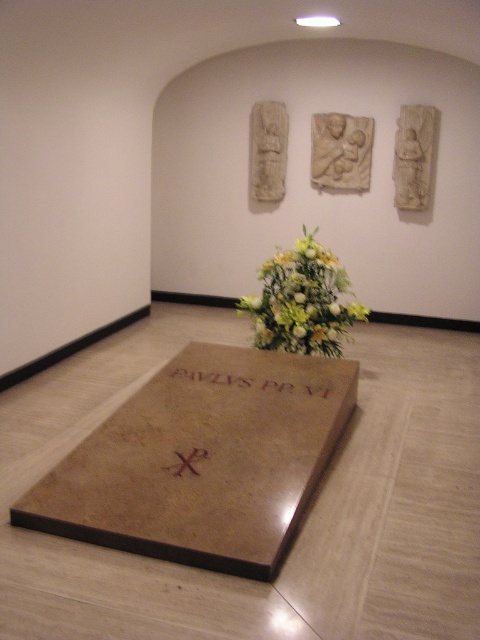
Question: Does yellow-green bouquet at center come behind brown wooden cross at center?

Choices:
 (A) yes
 (B) no

Answer: (A)

Question: Is yellow-green bouquet at center behind brown wooden cross at center?

Choices:
 (A) no
 (B) yes

Answer: (B)

Question: Estimate the real-world distances between objects in this image. Which object is closer to the dark brown stone slab at center?

Choices:
 (A) yellow-green bouquet at center
 (B) brown wooden cross at center

Answer: (A)

Question: Which is farther from the yellow-green bouquet at center?

Choices:
 (A) brown wooden cross at center
 (B) dark brown stone slab at center

Answer: (A)

Question: Which point is farther to the camera?

Choices:
 (A) (308, 275)
 (B) (261, 387)

Answer: (A)

Question: Can you confirm if dark brown stone slab at center is bigger than brown wooden cross at center?

Choices:
 (A) yes
 (B) no

Answer: (A)